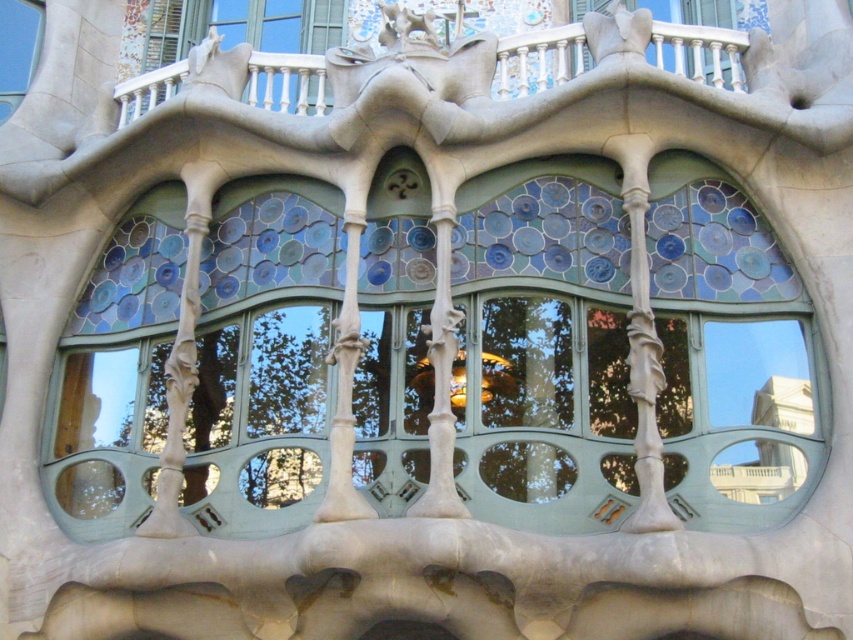
Question: Which object is closer to the camera taking this photo?

Choices:
 (A) blue mosaic glass at center
 (B) smooth stone balcony at upper center

Answer: (A)

Question: Does blue mosaic glass at center have a lesser width compared to smooth stone balcony at upper center?

Choices:
 (A) yes
 (B) no

Answer: (B)

Question: Is blue mosaic glass at center wider than smooth stone balcony at upper center?

Choices:
 (A) yes
 (B) no

Answer: (A)

Question: Which object is farther from the camera taking this photo?

Choices:
 (A) blue mosaic glass at center
 (B) stained glass window at upper left
 (C) smooth stone balcony at upper center

Answer: (B)

Question: Estimate the real-world distances between objects in this image. Which object is farther from the smooth stone balcony at upper center?

Choices:
 (A) blue mosaic glass at center
 (B) stained glass window at upper left

Answer: (B)

Question: Can you confirm if blue mosaic glass at center is wider than smooth stone balcony at upper center?

Choices:
 (A) yes
 (B) no

Answer: (A)